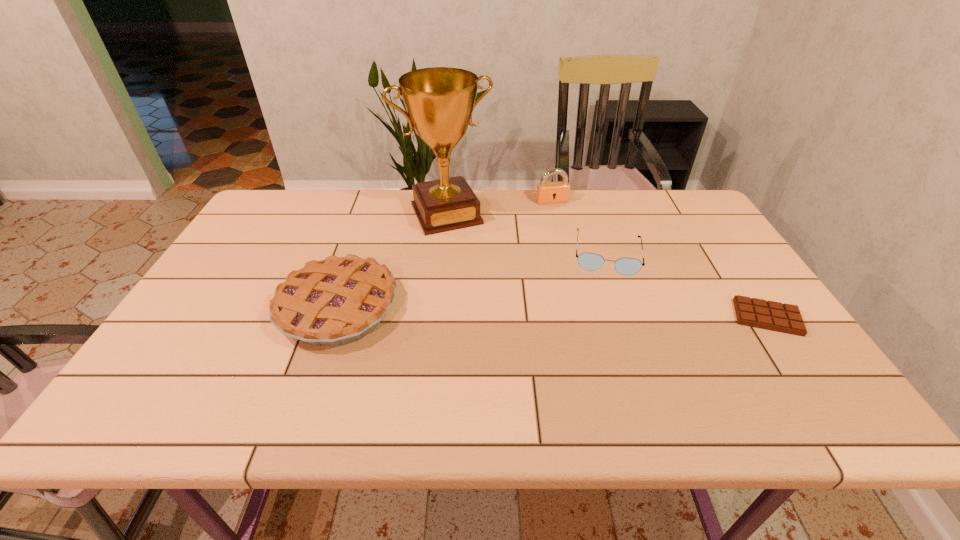
You are a GUI agent. You are given a task and a screenshot of the screen. Output one action in this format:
    pyautogui.click(x=<x>, y=<y>)
    Task: Click on the free space located to unlock the padlock from the front
    The width and height of the screenshot is (960, 540).
    Given the screenshot: What is the action you would take?
    pyautogui.click(x=585, y=265)

The width and height of the screenshot is (960, 540). Find the location of `free space located 0.350m on the lenses of the spectacles`. free space located 0.350m on the lenses of the spectacles is located at coordinates (608, 382).

Image resolution: width=960 pixels, height=540 pixels. I want to click on free space located on the lenses of the spectacles, so click(x=608, y=321).

Where is `free space located 0.330m on the lenses of the spectacles`? Image resolution: width=960 pixels, height=540 pixels. free space located 0.330m on the lenses of the spectacles is located at coordinates (608, 374).

You are a GUI agent. You are given a task and a screenshot of the screen. Output one action in this format:
    pyautogui.click(x=<x>, y=<y>)
    Task: Click on the vacant space positioned 0.390m on the plaque of the award
    
    Given the screenshot: What is the action you would take?
    pyautogui.click(x=505, y=324)

Where is `vacant space located 0.080m on the plaque of the award`? vacant space located 0.080m on the plaque of the award is located at coordinates (468, 250).

The height and width of the screenshot is (540, 960). I want to click on vacant space located 0.070m on the plaque of the award, so click(466, 248).

The width and height of the screenshot is (960, 540). In order to click on padlock present at the far edge in this screenshot , I will do `click(547, 192)`.

Where is `award that is at the far edge`? The image size is (960, 540). award that is at the far edge is located at coordinates (439, 101).

Locate an element on the screen. object located in the near edge section of the desktop is located at coordinates (339, 300).